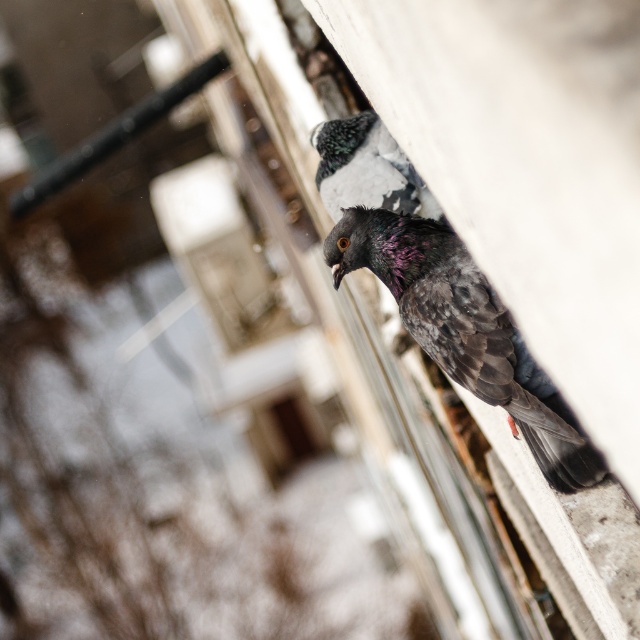
You are a photographer trying to capture both the shiny dark gray pigeon at upper right and the speckled feather pigeon at upper center in a single shot. Given that your camera lens has a maximum focus range of 2 meters, can you fit both birds into the frame without moving the camera?

The shiny dark gray pigeon at upper right is bigger than the speckled feather pigeon at upper center, but their positions and distances from the camera are not specified. Without knowing if they are within the 2 meter focus range, it is impossible to determine if both can be captured in the frame.

You are a birdwatcher observing two pigeons in an urban area. You notice a shiny dark gray pigeon at upper right and a speckled feather pigeon at upper center. Which pigeon is taller?

The shiny dark gray pigeon at upper right is taller than the speckled feather pigeon at upper center.

You are a photographer trying to capture both the shiny dark gray pigeon at upper right and the speckled feather pigeon at upper center in a single frame. Based on their positions, which pigeon is positioned more to the right?

The shiny dark gray pigeon at upper right is positioned more to the right than the speckled feather pigeon at upper center.